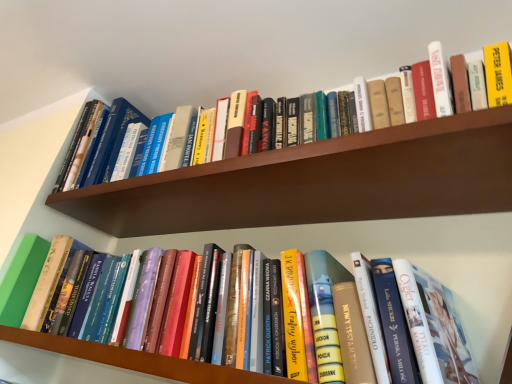
Find the location of a particular element. The image size is (512, 384). hardcover book at center, the 2th book when ordered from top to bottom is located at coordinates (232, 316).

The width and height of the screenshot is (512, 384). In order to click on wooden bookshelf at upper center, the 2th shelf in the bottom-to-top sequence in this screenshot , I will do `click(318, 182)`.

Describe the element at coordinates (318, 182) in the screenshot. I see `wooden bookshelf at upper center, positioned as the 1th shelf in top-to-bottom order` at that location.

You are a GUI agent. You are given a task and a screenshot of the screen. Output one action in this format:
    pyautogui.click(x=<x>, y=<y>)
    Task: Click on the hardcover book at center, the first book ordered from the bottom
    This screenshot has height=384, width=512.
    Given the screenshot: What is the action you would take?
    pyautogui.click(x=232, y=316)

In the scene shown: Is hardcover book at center, the first book ordered from the bottom, not near wooden bookshelf at upper center, the 2th shelf in the bottom-to-top sequence?

Actually, hardcover book at center, the first book ordered from the bottom, and wooden bookshelf at upper center, the 2th shelf in the bottom-to-top sequence, are a little close together.

Does point (246, 338) lie behind point (508, 144)?

Yes, it is.

Identify the location of shelf on the right of hardcover book at center, the first book ordered from the bottom. (318, 182).

Does hardcover book at center, the 2th book when ordered from top to bottom, have a lesser width compared to wooden bookshelf at upper center, the 2th shelf in the bottom-to-top sequence?

Correct, the width of hardcover book at center, the 2th book when ordered from top to bottom, is less than that of wooden bookshelf at upper center, the 2th shelf in the bottom-to-top sequence.

Based on the photo, is wooden bookshelf at upper center, positioned as the 1th shelf in top-to-bottom order, turned away from hardcover book at center, the first book ordered from the bottom?

No, wooden bookshelf at upper center, positioned as the 1th shelf in top-to-bottom order, is not facing away from hardcover book at center, the first book ordered from the bottom.

Which of these two, wooden bookshelf at upper center, the 2th shelf in the bottom-to-top sequence, or hardcover book at center, the 2th book when ordered from top to bottom, stands shorter?

wooden bookshelf at upper center, the 2th shelf in the bottom-to-top sequence.

Can you confirm if wooden bookshelf at upper center, positioned as the 1th shelf in top-to-bottom order, is thinner than hardcover book at center, the first book ordered from the bottom?

No.

Are wooden bookshelf at upper center, positioned as the 1th shelf in top-to-bottom order, and hardcover book at center, the 2th book when ordered from top to bottom, far apart?

wooden bookshelf at upper center, positioned as the 1th shelf in top-to-bottom order, is near hardcover book at center, the 2th book when ordered from top to bottom, not far away.

Is wooden bookshelf at upper center, positioned as the 1th shelf in top-to-bottom order, far away from hardcover books at center, placed as the first shelf when sorted from bottom to top?

No, wooden bookshelf at upper center, positioned as the 1th shelf in top-to-bottom order, is in close proximity to hardcover books at center, placed as the first shelf when sorted from bottom to top.

The height and width of the screenshot is (384, 512). What are the coordinates of `shelf below the wooden bookshelf at upper center, positioned as the 1th shelf in top-to-bottom order (from a real-world perspective)` in the screenshot? It's located at (138, 359).

In terms of height, does wooden bookshelf at upper center, the 2th shelf in the bottom-to-top sequence, look taller or shorter compared to hardcover books at center, the 2th shelf from the top?

wooden bookshelf at upper center, the 2th shelf in the bottom-to-top sequence, is shorter than hardcover books at center, the 2th shelf from the top.

Which object is closer to the camera, wooden bookshelf at upper center, the 2th shelf in the bottom-to-top sequence, or hardcover books at center, placed as the first shelf when sorted from bottom to top?

Positioned in front is hardcover books at center, placed as the first shelf when sorted from bottom to top.

From the image's perspective, is hardcover book at center, the 2th book when ordered from top to bottom, located above or below hardcover book at upper center, which is counted as the first book, starting from the top?

hardcover book at center, the 2th book when ordered from top to bottom, is below hardcover book at upper center, which is counted as the first book, starting from the top.

Is hardcover book at center, the 2th book when ordered from top to bottom, not near hardcover book at upper center, the second book in the bottom-to-top sequence?

No.

In terms of height, does hardcover book at center, the first book ordered from the bottom, look taller or shorter compared to hardcover book at upper center, which is counted as the first book, starting from the top?

Clearly, hardcover book at center, the first book ordered from the bottom, is taller compared to hardcover book at upper center, which is counted as the first book, starting from the top.

Considering the positions of point (293, 316) and point (434, 54), is point (293, 316) closer or farther from the camera than point (434, 54)?

Point (293, 316) is positioned closer to the camera compared to point (434, 54).

Where is `shelf behind the hardcover book at upper center, which is counted as the first book, starting from the top`? The width and height of the screenshot is (512, 384). shelf behind the hardcover book at upper center, which is counted as the first book, starting from the top is located at coordinates (318, 182).

Would you say hardcover book at upper center, which is counted as the first book, starting from the top, is outside wooden bookshelf at upper center, positioned as the 1th shelf in top-to-bottom order?

Yes, hardcover book at upper center, which is counted as the first book, starting from the top, is outside of wooden bookshelf at upper center, positioned as the 1th shelf in top-to-bottom order.

Considering the relative positions of hardcover book at upper center, the second book in the bottom-to-top sequence, and wooden bookshelf at upper center, positioned as the 1th shelf in top-to-bottom order, in the image provided, is hardcover book at upper center, the second book in the bottom-to-top sequence, to the right of wooden bookshelf at upper center, positioned as the 1th shelf in top-to-bottom order, from the viewer's perspective?

Incorrect, hardcover book at upper center, the second book in the bottom-to-top sequence, is not on the right side of wooden bookshelf at upper center, positioned as the 1th shelf in top-to-bottom order.

Between hardcover book at upper center, the second book in the bottom-to-top sequence, and wooden bookshelf at upper center, positioned as the 1th shelf in top-to-bottom order, which one has larger size?

hardcover book at upper center, the second book in the bottom-to-top sequence.

Is wooden bookshelf at upper center, the 2th shelf in the bottom-to-top sequence, far away from hardcover book at upper center, which is counted as the first book, starting from the top?

No.

Looking at this image, does wooden bookshelf at upper center, positioned as the 1th shelf in top-to-bottom order, appear on the right side of hardcover book at upper center, which is counted as the first book, starting from the top?

Yes.

Considering the positions of objects wooden bookshelf at upper center, positioned as the 1th shelf in top-to-bottom order, and hardcover book at upper center, which is counted as the first book, starting from the top, in the image provided, who is in front, wooden bookshelf at upper center, positioned as the 1th shelf in top-to-bottom order, or hardcover book at upper center, which is counted as the first book, starting from the top,?

hardcover book at upper center, which is counted as the first book, starting from the top, is in front.

Which is correct: hardcover book at upper center, the second book in the bottom-to-top sequence, is inside hardcover books at center, the 2th shelf from the top, or outside of it?

hardcover book at upper center, the second book in the bottom-to-top sequence, is outside hardcover books at center, the 2th shelf from the top.

Based on the photo, from a real-world perspective, is hardcover book at upper center, the second book in the bottom-to-top sequence, beneath hardcover books at center, placed as the first shelf when sorted from bottom to top?

No, from a real-world perspective, hardcover book at upper center, the second book in the bottom-to-top sequence, is not beneath hardcover books at center, placed as the first shelf when sorted from bottom to top.

Which of these two, hardcover book at upper center, the second book in the bottom-to-top sequence, or hardcover books at center, placed as the first shelf when sorted from bottom to top, stands taller?

With more height is hardcover book at upper center, the second book in the bottom-to-top sequence.

Could you tell me if hardcover book at upper center, which is counted as the first book, starting from the top, is turned towards hardcover books at center, placed as the first shelf when sorted from bottom to top?

No.

Where is `the 1st book to the left when counting from the wooden bookshelf at upper center, the 2th shelf in the bottom-to-top sequence`? the 1st book to the left when counting from the wooden bookshelf at upper center, the 2th shelf in the bottom-to-top sequence is located at coordinates (232, 316).

The image size is (512, 384). In order to click on shelf on the right of hardcover book at center, the 2th book when ordered from top to bottom in this screenshot , I will do `click(318, 182)`.

Estimate the real-world distances between objects in this image. Which object is further from hardcover book at upper center, the second book in the bottom-to-top sequence, hardcover books at center, the 2th shelf from the top, or hardcover book at center, the first book ordered from the bottom?

Based on the image, hardcover books at center, the 2th shelf from the top, appears to be further to hardcover book at upper center, the second book in the bottom-to-top sequence.

From the image, which object appears to be nearer to hardcover book at upper center, the second book in the bottom-to-top sequence, wooden bookshelf at upper center, the 2th shelf in the bottom-to-top sequence, or hardcover books at center, placed as the first shelf when sorted from bottom to top?

Among the two, wooden bookshelf at upper center, the 2th shelf in the bottom-to-top sequence, is located nearer to hardcover book at upper center, the second book in the bottom-to-top sequence.

Estimate the real-world distances between objects in this image. Which object is closer to hardcover book at center, the first book ordered from the bottom, hardcover books at center, placed as the first shelf when sorted from bottom to top, or wooden bookshelf at upper center, positioned as the 1th shelf in top-to-bottom order?

hardcover books at center, placed as the first shelf when sorted from bottom to top, is positioned closer to the anchor hardcover book at center, the first book ordered from the bottom.

Based on their spatial positions, is hardcover book at upper center, which is counted as the first book, starting from the top, or wooden bookshelf at upper center, the 2th shelf in the bottom-to-top sequence, further from hardcover books at center, placed as the first shelf when sorted from bottom to top?

hardcover book at upper center, which is counted as the first book, starting from the top, is further to hardcover books at center, placed as the first shelf when sorted from bottom to top.

Which object lies further to the anchor point hardcover books at center, the 2th shelf from the top, hardcover book at center, the first book ordered from the bottom, or hardcover book at upper center, which is counted as the first book, starting from the top?

hardcover book at upper center, which is counted as the first book, starting from the top, lies further to hardcover books at center, the 2th shelf from the top, than the other object.

Estimate the real-world distances between objects in this image. Which object is further from hardcover books at center, placed as the first shelf when sorted from bottom to top, hardcover book at upper center, the second book in the bottom-to-top sequence, or hardcover book at center, the first book ordered from the bottom?

hardcover book at upper center, the second book in the bottom-to-top sequence.

Based on their spatial positions, is hardcover book at center, the 2th book when ordered from top to bottom, or hardcover book at upper center, the second book in the bottom-to-top sequence, further from wooden bookshelf at upper center, the 2th shelf in the bottom-to-top sequence?

hardcover book at center, the 2th book when ordered from top to bottom.

From the picture: Which object lies further to the anchor point hardcover book at upper center, the second book in the bottom-to-top sequence, wooden bookshelf at upper center, the 2th shelf in the bottom-to-top sequence, or hardcover book at center, the first book ordered from the bottom?

The object further to hardcover book at upper center, the second book in the bottom-to-top sequence, is hardcover book at center, the first book ordered from the bottom.

Where is `shelf between hardcover book at upper center, which is counted as the first book, starting from the top, and hardcover books at center, the 2th shelf from the top, from top to bottom`? This screenshot has width=512, height=384. shelf between hardcover book at upper center, which is counted as the first book, starting from the top, and hardcover books at center, the 2th shelf from the top, from top to bottom is located at coordinates (318, 182).

Identify the location of book that lies between wooden bookshelf at upper center, the 2th shelf in the bottom-to-top sequence, and hardcover books at center, the 2th shelf from the top, from top to bottom. (232, 316).

Locate an element on the screen. book between hardcover book at upper center, the second book in the bottom-to-top sequence, and hardcover books at center, placed as the first shelf when sorted from bottom to top, vertically is located at coordinates (232, 316).

Where is `shelf between hardcover book at upper center, which is counted as the first book, starting from the top, and hardcover book at center, the first book ordered from the bottom, in the vertical direction`? The image size is (512, 384). shelf between hardcover book at upper center, which is counted as the first book, starting from the top, and hardcover book at center, the first book ordered from the bottom, in the vertical direction is located at coordinates (318, 182).